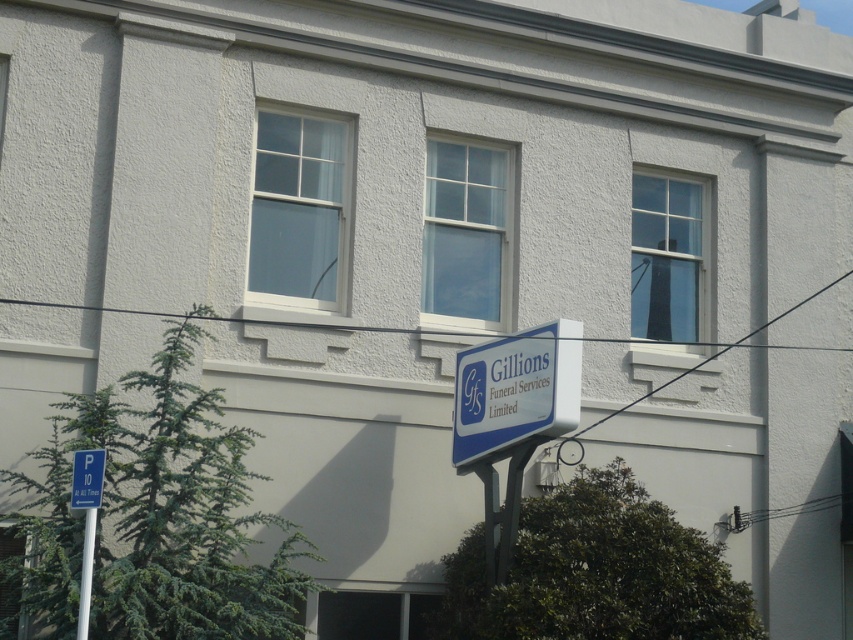
Question: Can you confirm if green plastic parking sign at lower left is positioned to the right of white plastic pole at lower left?

Choices:
 (A) yes
 (B) no

Answer: (B)

Question: Which object is positioned closest to the white plastic pole at lower left?

Choices:
 (A) green plastic parking sign at lower left
 (B) blue plastic sign at center

Answer: (A)

Question: From the image, what is the correct spatial relationship of blue plastic sign at center in relation to green plastic parking sign at lower left?

Choices:
 (A) left
 (B) right

Answer: (B)

Question: Which is farther from the white plastic pole at lower left?

Choices:
 (A) blue plastic sign at center
 (B) green plastic parking sign at lower left

Answer: (A)

Question: Which is nearer to the white plastic pole at lower left?

Choices:
 (A) blue plastic sign at center
 (B) green plastic parking sign at lower left

Answer: (B)

Question: Can you confirm if blue plastic sign at center is thinner than green plastic parking sign at lower left?

Choices:
 (A) no
 (B) yes

Answer: (A)